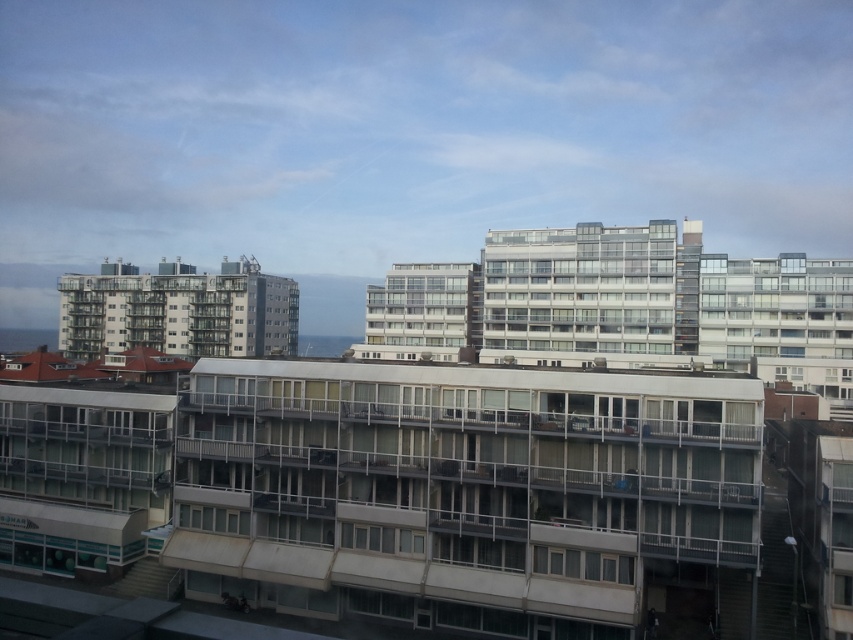
Question: Which point is closer to the camera?

Choices:
 (A) (367, 584)
 (B) (163, 284)

Answer: (A)

Question: Is white concrete building at center wider than matte glass building at left?

Choices:
 (A) no
 (B) yes

Answer: (A)

Question: Is white concrete building at center smaller than matte glass building at left?

Choices:
 (A) no
 (B) yes

Answer: (B)

Question: Which point is farther to the camera?

Choices:
 (A) white concrete building at center
 (B) matte glass building at left

Answer: (B)

Question: Can you confirm if white concrete building at center is positioned above matte glass building at left?

Choices:
 (A) no
 (B) yes

Answer: (A)

Question: Among these objects, which one is farthest from the camera?

Choices:
 (A) matte glass building at left
 (B) white concrete building at center

Answer: (A)